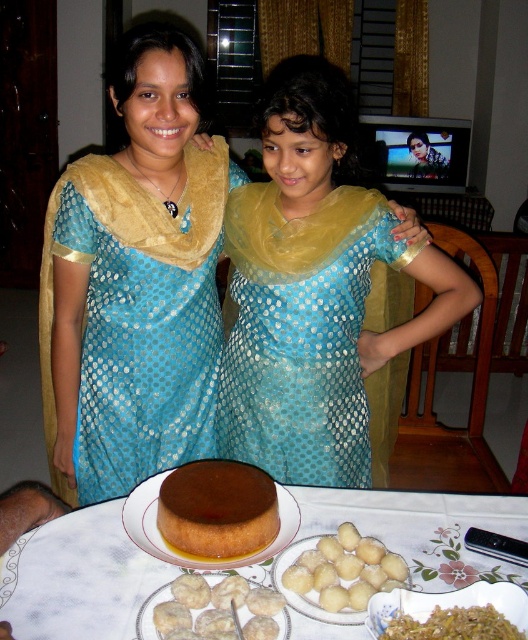
You are a GUI agent. You are given a task and a screenshot of the screen. Output one action in this format:
    pyautogui.click(x=<x>, y=<y>)
    Task: Click on the smooth white table at center
    The width and height of the screenshot is (528, 640).
    Given the screenshot: What is the action you would take?
    pyautogui.click(x=78, y=579)

Looking at this image, between smooth white table at center and brown glossy rice at lower right, which one has less height?

brown glossy rice at lower right is shorter.

Does point (126, 608) lie behind point (421, 632)?

Yes, it is behind point (421, 632).

This screenshot has width=528, height=640. What are the coordinates of `smooth white table at center` in the screenshot? It's located at (78, 579).

Can you confirm if blue dotted fabric dress at upper left is shorter than brown glossy cake at center?

No, blue dotted fabric dress at upper left is not shorter than brown glossy cake at center.

This screenshot has height=640, width=528. Find the location of `blue dotted fabric dress at upper left`. blue dotted fabric dress at upper left is located at coordinates (137, 317).

Is point (367, 420) farther from viewer compared to point (212, 625)?

That is True.

Can you confirm if blue dotted fabric dress at center is bigger than white matte dumplings at center?

Yes, blue dotted fabric dress at center is bigger than white matte dumplings at center.

This screenshot has height=640, width=528. What do you see at coordinates (307, 337) in the screenshot?
I see `blue dotted fabric dress at center` at bounding box center [307, 337].

Locate an element on the screen. blue dotted fabric dress at center is located at coordinates (307, 337).